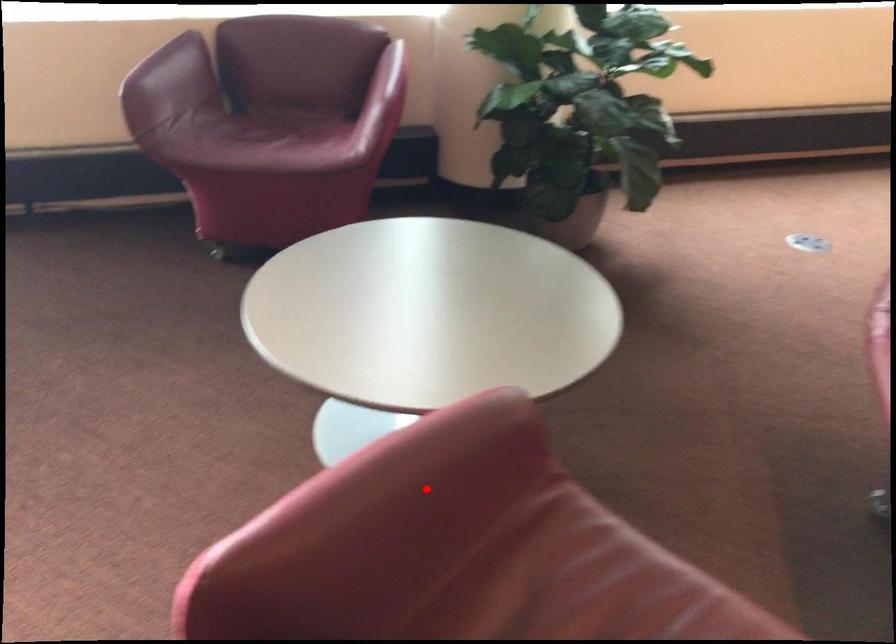
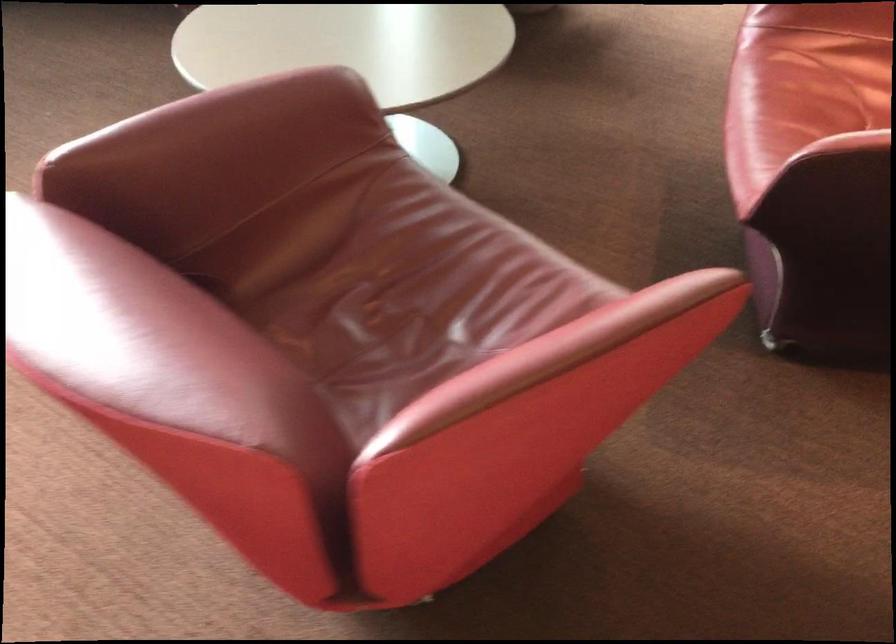
Question: I am providing you with two images of the same scene from different viewpoints. Given a red point in image1, look at the same physical point in image2. Is it:

Choices:
 (A) Closer to the viewpoint
 (B) Farther from the viewpoint

Answer: (B)